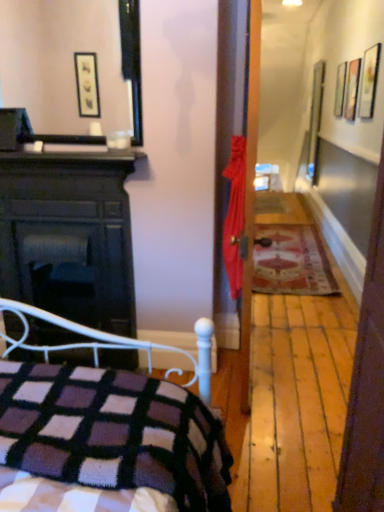
Question: From a real-world perspective, is wooden picture frame at upper right over dark wood fireplace at left?

Choices:
 (A) yes
 (B) no

Answer: (A)

Question: Does wooden picture frame at upper right have a smaller size compared to dark wood fireplace at left?

Choices:
 (A) yes
 (B) no

Answer: (A)

Question: Would you consider wooden picture frame at upper right to be distant from dark wood fireplace at left?

Choices:
 (A) no
 (B) yes

Answer: (B)

Question: Is wooden picture frame at upper right positioned in front of dark wood fireplace at left?

Choices:
 (A) no
 (B) yes

Answer: (A)

Question: Is wooden picture frame at upper right positioned behind dark wood fireplace at left?

Choices:
 (A) no
 (B) yes

Answer: (B)

Question: Which is correct: knitted wool blanket at lower left is inside dark wood fireplace at left, or outside of it?

Choices:
 (A) inside
 (B) outside

Answer: (B)

Question: Is point [114, 395] closer or farther from the camera than point [125, 261]?

Choices:
 (A) farther
 (B) closer

Answer: (B)

Question: Is knitted wool blanket at lower left in front of or behind dark wood fireplace at left in the image?

Choices:
 (A) behind
 (B) front

Answer: (B)

Question: In the image, is knitted wool blanket at lower left on the left side or the right side of dark wood fireplace at left?

Choices:
 (A) left
 (B) right

Answer: (B)

Question: Considering the positions of wooden picture frame at upper right and dark wood fireplace at left in the image, is wooden picture frame at upper right wider or thinner than dark wood fireplace at left?

Choices:
 (A) wide
 (B) thin

Answer: (B)

Question: Considering the relative positions of wooden picture frame at upper right and dark wood fireplace at left in the image provided, is wooden picture frame at upper right to the left or to the right of dark wood fireplace at left?

Choices:
 (A) left
 (B) right

Answer: (B)

Question: Is wooden picture frame at upper right taller or shorter than dark wood fireplace at left?

Choices:
 (A) tall
 (B) short

Answer: (B)

Question: From a real-world perspective, relative to dark wood fireplace at left, is wooden picture frame at upper right vertically above or below?

Choices:
 (A) above
 (B) below

Answer: (A)

Question: Is dark wood fireplace at left inside or outside of carpeted mat at hallway center?

Choices:
 (A) inside
 (B) outside

Answer: (B)

Question: Is dark wood fireplace at left wider or thinner than carpeted mat at hallway center?

Choices:
 (A) wide
 (B) thin

Answer: (B)